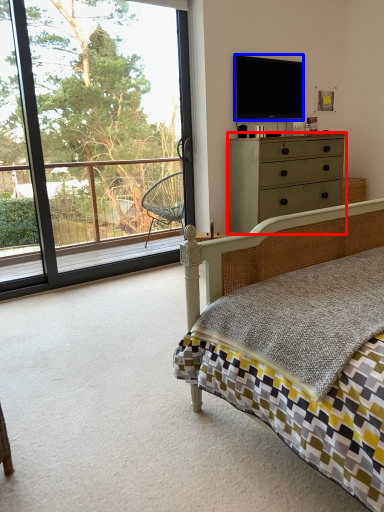
Question: Which object appears farthest to the camera in this image, chest of drawers (highlighted by a red box) or television (highlighted by a blue box)?

Choices:
 (A) chest of drawers
 (B) television

Answer: (B)